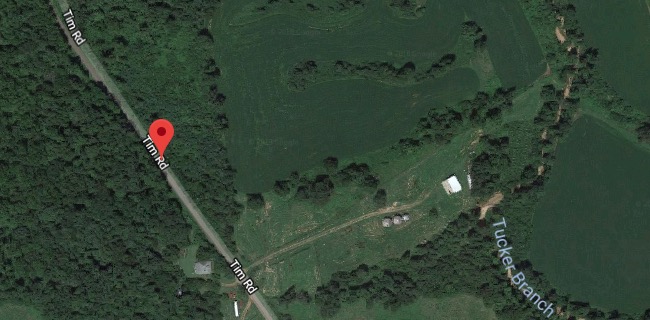
Where is `map`? The width and height of the screenshot is (650, 320). map is located at coordinates (331, 157).